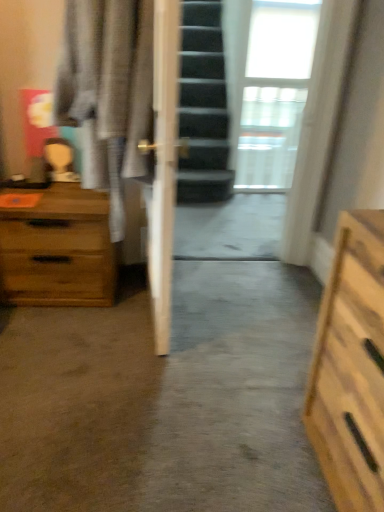
Question: Is wooden chest of drawers at left aimed at transparent glass door at center?

Choices:
 (A) yes
 (B) no

Answer: (B)

Question: Is wooden chest of drawers at left not near transparent glass door at center?

Choices:
 (A) yes
 (B) no

Answer: (A)

Question: Can you confirm if wooden chest of drawers at left is taller than transparent glass door at center?

Choices:
 (A) yes
 (B) no

Answer: (B)

Question: Considering the relative sizes of wooden chest of drawers at left and transparent glass door at center in the image provided, is wooden chest of drawers at left wider than transparent glass door at center?

Choices:
 (A) no
 (B) yes

Answer: (B)

Question: Does wooden chest of drawers at left have a lesser width compared to transparent glass door at center?

Choices:
 (A) no
 (B) yes

Answer: (A)

Question: Would you say light gray fabric robe at left is to the left or to the right of wooden chest of drawers at left in the picture?

Choices:
 (A) left
 (B) right

Answer: (B)

Question: Is light gray fabric robe at left bigger or smaller than wooden chest of drawers at left?

Choices:
 (A) big
 (B) small

Answer: (A)

Question: From the image's perspective, is light gray fabric robe at left above or below wooden chest of drawers at left?

Choices:
 (A) below
 (B) above

Answer: (B)

Question: Looking at their shapes, would you say light gray fabric robe at left is wider or thinner than wooden chest of drawers at left?

Choices:
 (A) wide
 (B) thin

Answer: (B)

Question: In terms of size, does light gray fabric robe at left appear bigger or smaller than transparent glass door at center?

Choices:
 (A) big
 (B) small

Answer: (A)

Question: Looking at their shapes, would you say light gray fabric robe at left is wider or thinner than transparent glass door at center?

Choices:
 (A) thin
 (B) wide

Answer: (B)

Question: From a real-world perspective, is light gray fabric robe at left positioned above or below transparent glass door at center?

Choices:
 (A) below
 (B) above

Answer: (B)

Question: Is point (97, 28) positioned closer to the camera than point (292, 89)?

Choices:
 (A) farther
 (B) closer

Answer: (B)

Question: Considering the relative positions of transparent glass door at center and white sheer curtain at upper right in the image provided, is transparent glass door at center to the left or to the right of white sheer curtain at upper right?

Choices:
 (A) left
 (B) right

Answer: (A)

Question: Is point (208, 163) closer or farther from the camera than point (264, 181)?

Choices:
 (A) farther
 (B) closer

Answer: (B)